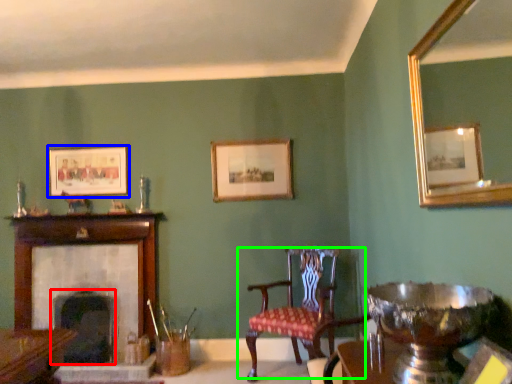
Question: Based on their relative distances, which object is farther from fireplace (highlighted by a red box)? Choose from picture frame (highlighted by a blue box) and chair (highlighted by a green box).

Choices:
 (A) picture frame
 (B) chair

Answer: (B)